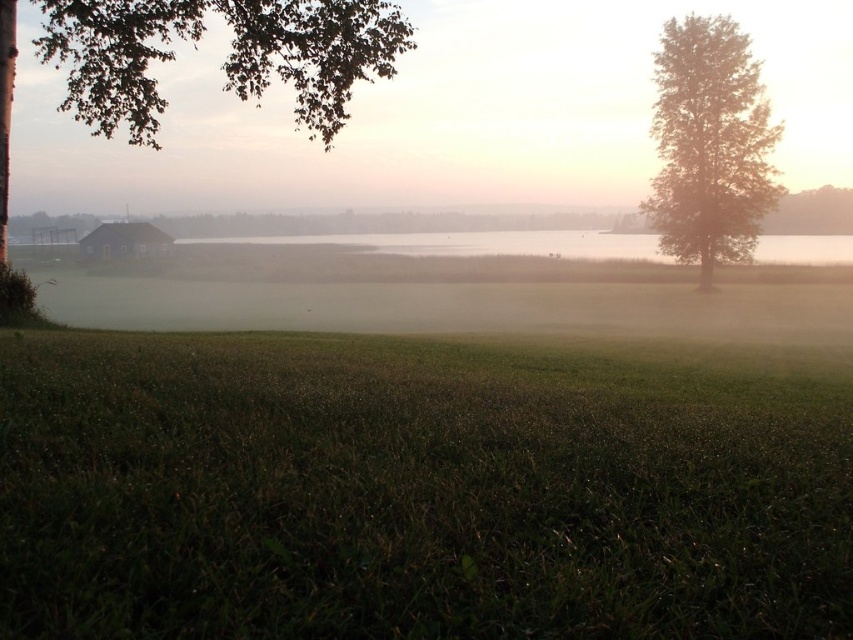
Question: Which point is farther to the camera?

Choices:
 (A) green leafy tree at right
 (B) green grassy field at lower center
 (C) green leafy tree at upper left

Answer: (A)

Question: Which point is closer to the camera?

Choices:
 (A) green leafy tree at right
 (B) green leafy tree at upper left

Answer: (B)

Question: Which point is closer to the camera taking this photo?

Choices:
 (A) (664, 220)
 (B) (254, 419)

Answer: (B)

Question: Is green grassy field at lower center bigger than green leafy tree at upper left?

Choices:
 (A) yes
 (B) no

Answer: (B)

Question: In this image, where is green leafy tree at upper left located relative to green leafy tree at right?

Choices:
 (A) above
 (B) below

Answer: (A)

Question: Does green grassy field at lower center appear under green leafy tree at right?

Choices:
 (A) no
 (B) yes

Answer: (B)